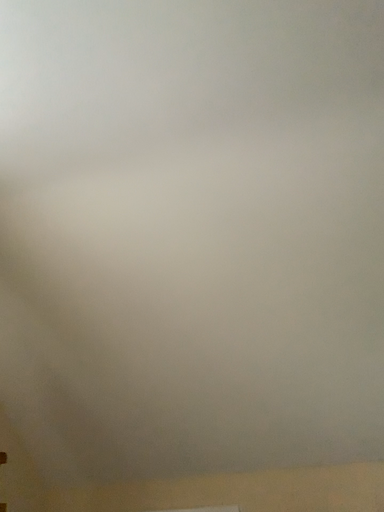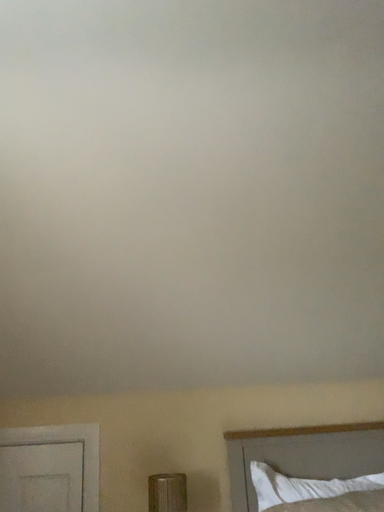
Question: Which way did the camera rotate in the video?

Choices:
 (A) rotated right
 (B) rotated left

Answer: (A)